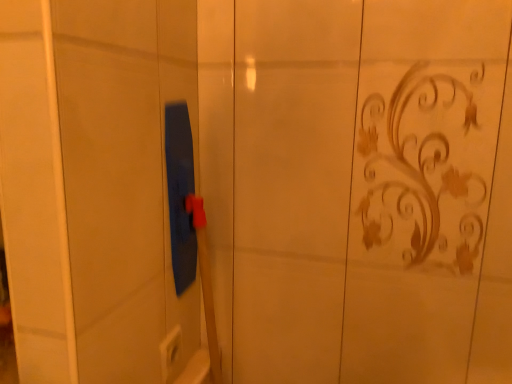
Question: In which direction should I rotate to look at white plastic electric outlet at lower center?

Choices:
 (A) left
 (B) right

Answer: (A)

Question: Is white plastic electric outlet at lower center beside blue rubber squeegee at center?

Choices:
 (A) no
 (B) yes

Answer: (A)

Question: Considering the relative positions of white plastic electric outlet at lower center and blue rubber squeegee at center in the image provided, is white plastic electric outlet at lower center to the right of blue rubber squeegee at center from the viewer's perspective?

Choices:
 (A) no
 (B) yes

Answer: (B)

Question: Is there a large distance between white plastic electric outlet at lower center and blue rubber squeegee at center?

Choices:
 (A) no
 (B) yes

Answer: (A)

Question: From a real-world perspective, is white plastic electric outlet at lower center located higher than blue rubber squeegee at center?

Choices:
 (A) yes
 (B) no

Answer: (B)

Question: Would you say white plastic electric outlet at lower center contains blue rubber squeegee at center?

Choices:
 (A) no
 (B) yes

Answer: (A)

Question: Is the position of white plastic electric outlet at lower center more distant than that of blue rubber squeegee at center?

Choices:
 (A) yes
 (B) no

Answer: (A)

Question: Is blue rubber squeegee at center beside white plastic electric outlet at lower center?

Choices:
 (A) no
 (B) yes

Answer: (A)

Question: Is blue rubber squeegee at center bigger than white plastic electric outlet at lower center?

Choices:
 (A) no
 (B) yes

Answer: (B)

Question: Is blue rubber squeegee at center completely or partially outside of white plastic electric outlet at lower center?

Choices:
 (A) yes
 (B) no

Answer: (A)

Question: Is blue rubber squeegee at center oriented towards white plastic electric outlet at lower center?

Choices:
 (A) yes
 (B) no

Answer: (B)

Question: Is blue rubber squeegee at center looking in the opposite direction of white plastic electric outlet at lower center?

Choices:
 (A) yes
 (B) no

Answer: (A)

Question: Is blue rubber squeegee at center positioned before white plastic electric outlet at lower center?

Choices:
 (A) no
 (B) yes

Answer: (B)

Question: Do you think white plastic electric outlet at lower center is within blue rubber squeegee at center, or outside of it?

Choices:
 (A) inside
 (B) outside

Answer: (A)